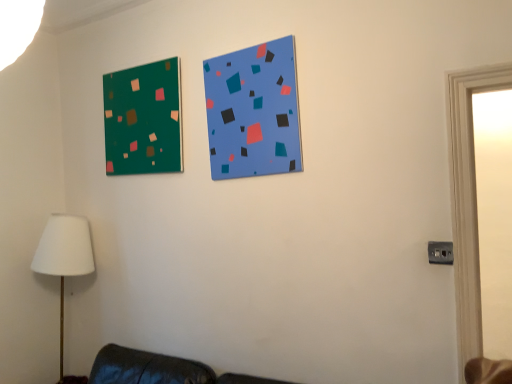
Question: In terms of height, does green matte board at upper left, which is the 1th bulletin board from left to right, look taller or shorter compared to white fabric lampshade at lower left?

Choices:
 (A) tall
 (B) short

Answer: (B)

Question: Considering their positions, is green matte board at upper left, the second bulletin board viewed from the front, located in front of or behind white fabric lampshade at lower left?

Choices:
 (A) behind
 (B) front

Answer: (B)

Question: Based on their relative distances, which object is nearer to the green matte board at upper left, which is counted as the 2th bulletin board, starting from the right?

Choices:
 (A) white fabric lampshade at lower left
 (B) blue matte bulletin board at upper center, the 2th bulletin board in the left-to-right sequence

Answer: (B)

Question: Considering the real-world distances, which object is closest to the white fabric lampshade at lower left?

Choices:
 (A) green matte board at upper left, which is the 1th bulletin board from left to right
 (B) blue matte bulletin board at upper center, the 2th bulletin board in the left-to-right sequence

Answer: (A)